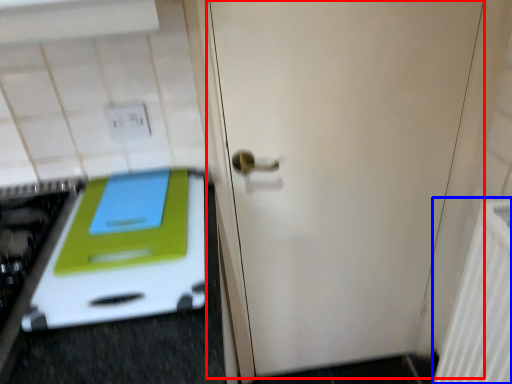
Question: Which object appears farthest to the camera in this image, door (highlighted by a red box) or radiator (highlighted by a blue box)?

Choices:
 (A) door
 (B) radiator

Answer: (A)